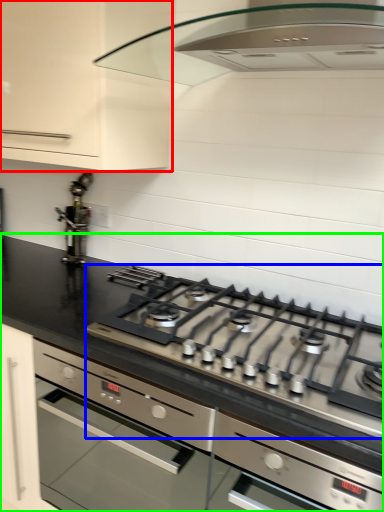
Question: Based on their relative distances, which object is nearer to cabinetry (highlighted by a red box)? Choose from gas stove (highlighted by a blue box) and countertop (highlighted by a green box).

Choices:
 (A) gas stove
 (B) countertop

Answer: (B)